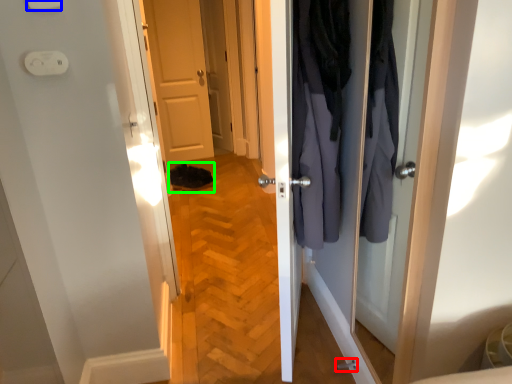
Question: Estimate the real-world distances between objects in this image. Which object is farther from door handle (highlighted by a red box), light switch (highlighted by a blue box) or shoe (highlighted by a green box)?

Choices:
 (A) light switch
 (B) shoe

Answer: (B)